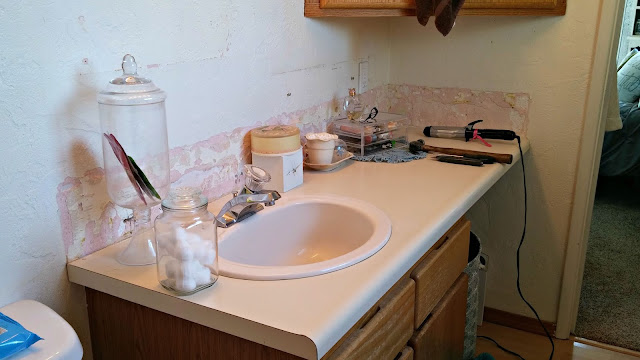
The image size is (640, 360). In order to click on cup in this screenshot , I will do `click(320, 158)`.